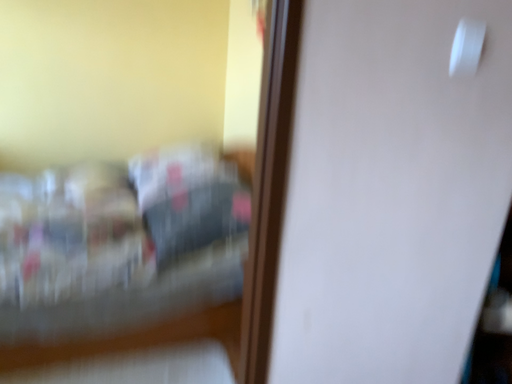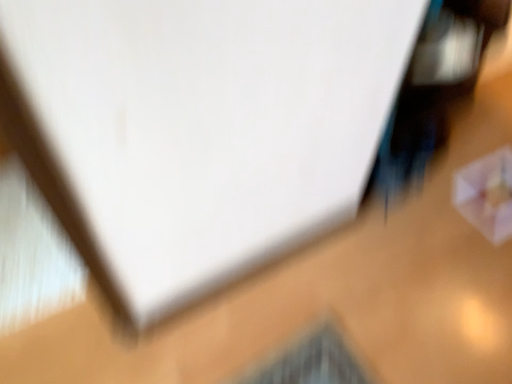
Question: Which way did the camera rotate in the video?

Choices:
 (A) rotated upward
 (B) rotated downward

Answer: (B)